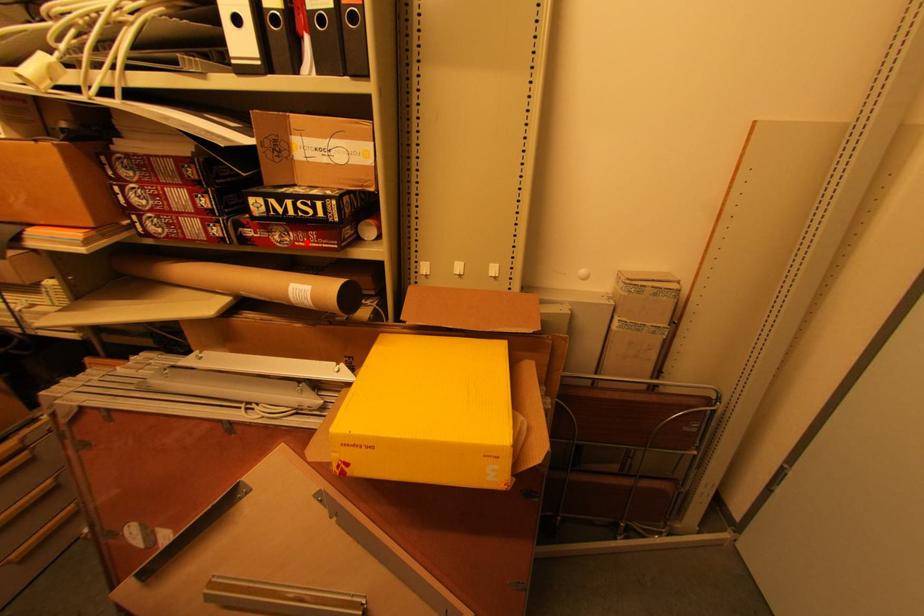
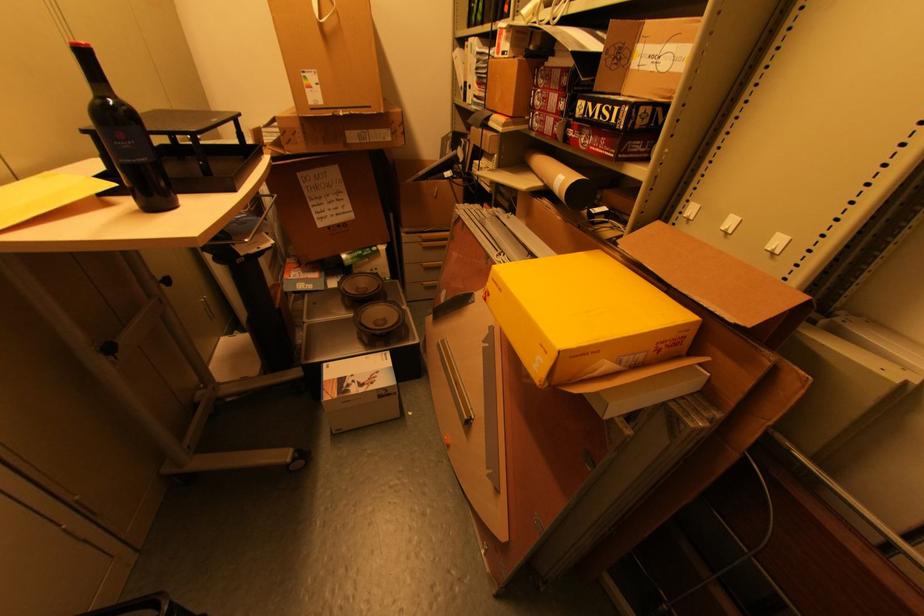
Find the pixel in the second image that matches the highlighted location in the first image.

(599, 148)